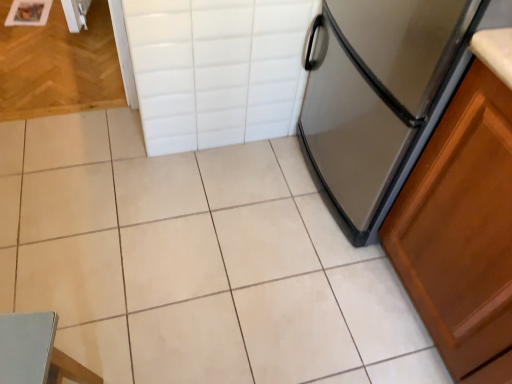
In order to click on space that is in front of satin silver refrigerator at right in this screenshot , I will do `click(330, 301)`.